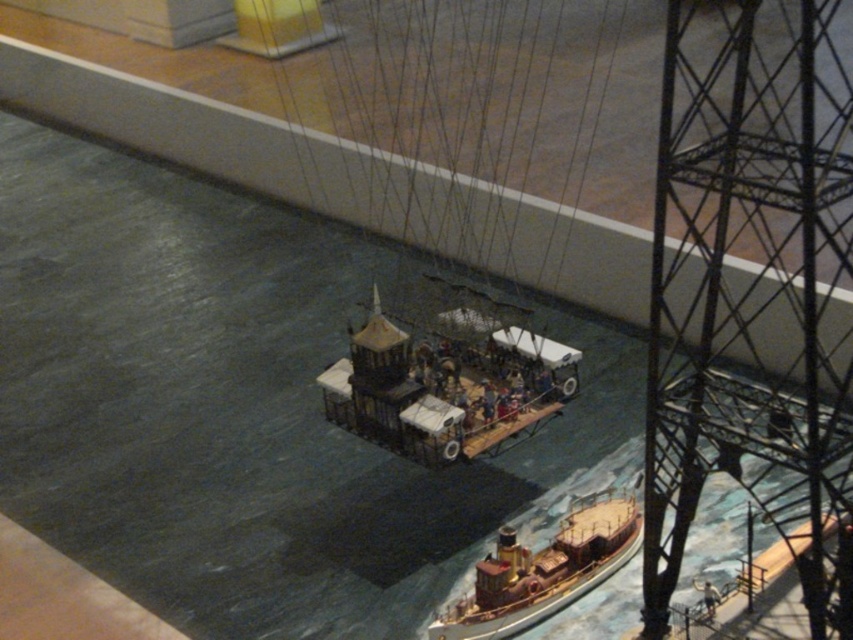
Question: Which point is closer to the camera?

Choices:
 (A) wooden ship at center
 (B) wooden ship at lower right

Answer: (B)

Question: Which of the following is the closest to the observer?

Choices:
 (A) (497, 580)
 (B) (357, 429)

Answer: (A)

Question: Can you confirm if wooden ship at center is positioned to the left of wooden ship at lower right?

Choices:
 (A) yes
 (B) no

Answer: (A)

Question: Is wooden ship at center above wooden ship at lower right?

Choices:
 (A) no
 (B) yes

Answer: (B)

Question: Which of the following is the farthest from the observer?

Choices:
 (A) (479, 563)
 (B) (352, 365)

Answer: (B)

Question: Can you confirm if wooden ship at center is bigger than wooden ship at lower right?

Choices:
 (A) yes
 (B) no

Answer: (A)